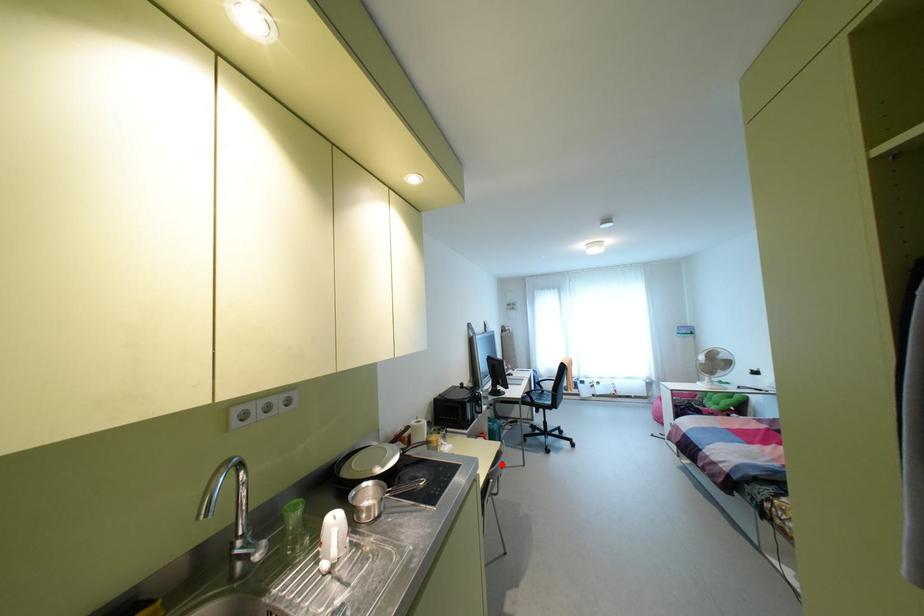
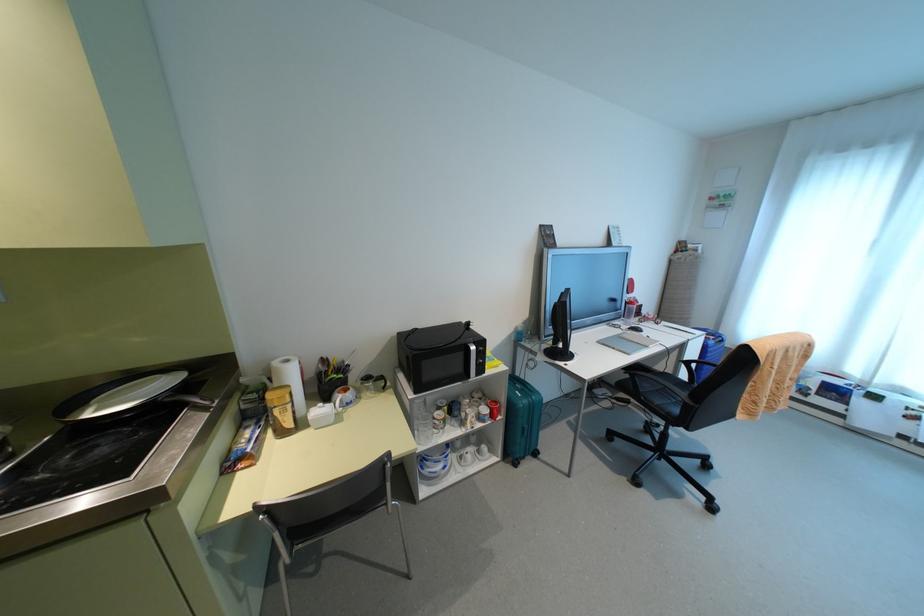
In the second image, find the point that corresponds to the highlighted location in the first image.

(535, 454)